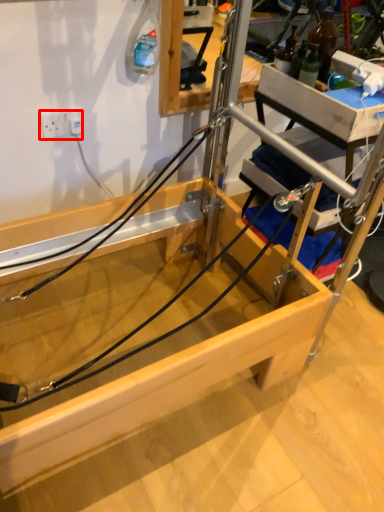
Question: From the image, what is the correct spatial relationship of electric outlet (annotated by the red box) in relation to string?

Choices:
 (A) right
 (B) left

Answer: (B)